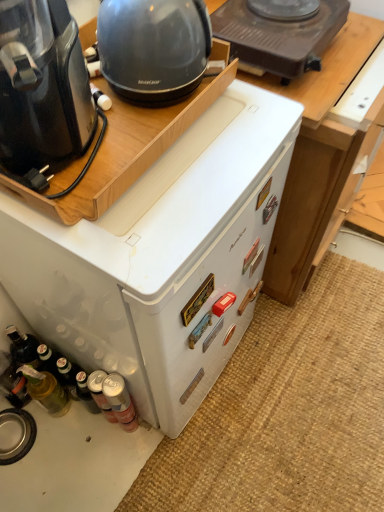
Where is `vacant region in front of metallic silver can at lower left, which is the second bottle from right to left`? The image size is (384, 512). vacant region in front of metallic silver can at lower left, which is the second bottle from right to left is located at coordinates (109, 470).